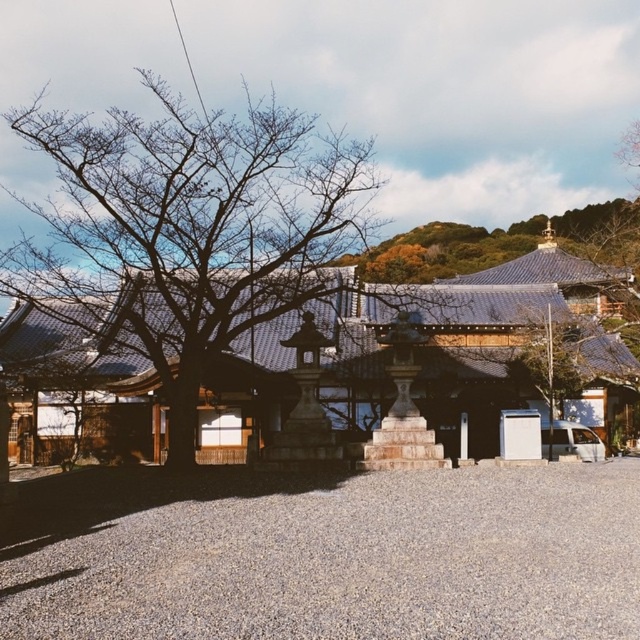
You are a visitor at a Japanese garden and want to walk from the entrance to the temple. You see the gray gravel at center and the bare wood tree at left. Which object is closer to the entrance?

The bare wood tree at left is closer to the entrance because the gray gravel at center is positioned on the right side of it, meaning the tree is in front of the gravel path leading towards the temple.

Looking at this image, you are a visitor at the temple and want to take a photo of the gray gravel at center and the bare wood tree at left. Which object should you focus on first if you want to capture both in the same frame without moving the camera?

The gray gravel at center is located below the bare wood tree at left, so you should focus on the bare wood tree at left first to ensure both are in the frame.